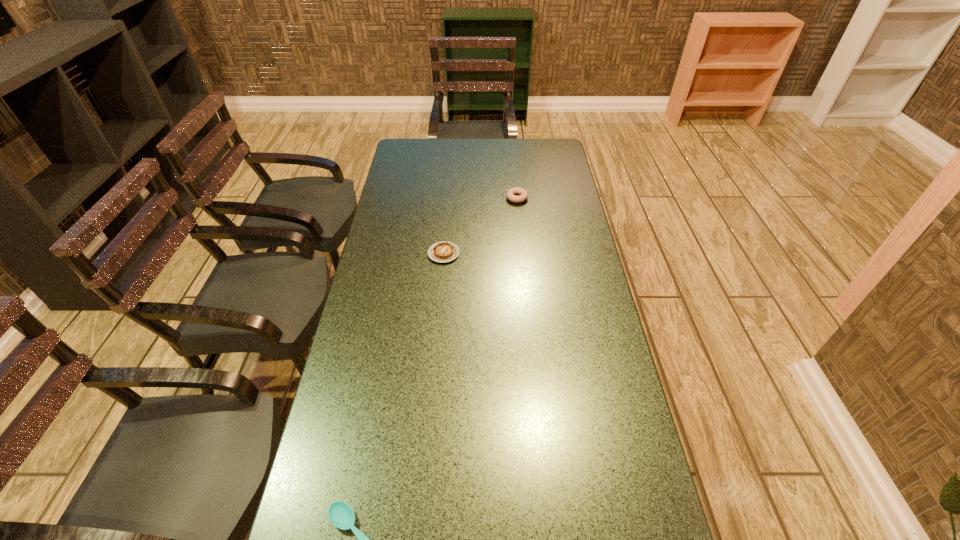
This screenshot has width=960, height=540. I want to click on the tallest object, so click(x=511, y=194).

The image size is (960, 540). Find the location of `the farthest object`. the farthest object is located at coordinates (511, 194).

Image resolution: width=960 pixels, height=540 pixels. I want to click on quiche, so click(444, 251).

Find the location of `the second shortest object`. the second shortest object is located at coordinates (444, 251).

Where is `vacant space situated on the left of the doughnut`? This screenshot has width=960, height=540. vacant space situated on the left of the doughnut is located at coordinates (451, 198).

You are a GUI agent. You are given a task and a screenshot of the screen. Output one action in this format:
    pyautogui.click(x=<x>, y=<y>)
    Task: Click on the free space located on the front of the second nearest object
    Image resolution: width=960 pixels, height=540 pixels.
    Given the screenshot: What is the action you would take?
    pyautogui.click(x=437, y=329)

You are a GUI agent. You are given a task and a screenshot of the screen. Output one action in this format:
    pyautogui.click(x=<x>, y=<y>)
    Task: Click on the vacant space at the far edge
    
    Given the screenshot: What is the action you would take?
    pyautogui.click(x=483, y=158)

Find the location of a particular element. free spot at the left edge of the desktop is located at coordinates (380, 361).

At what (x,y) coordinates should I click in order to perform the action: click on free space at the right edge. Please return your answer as a coordinate pair (x, y). Looking at the image, I should click on (595, 387).

Locate an element on the screen. free point between the quiche and the farthest object is located at coordinates [480, 226].